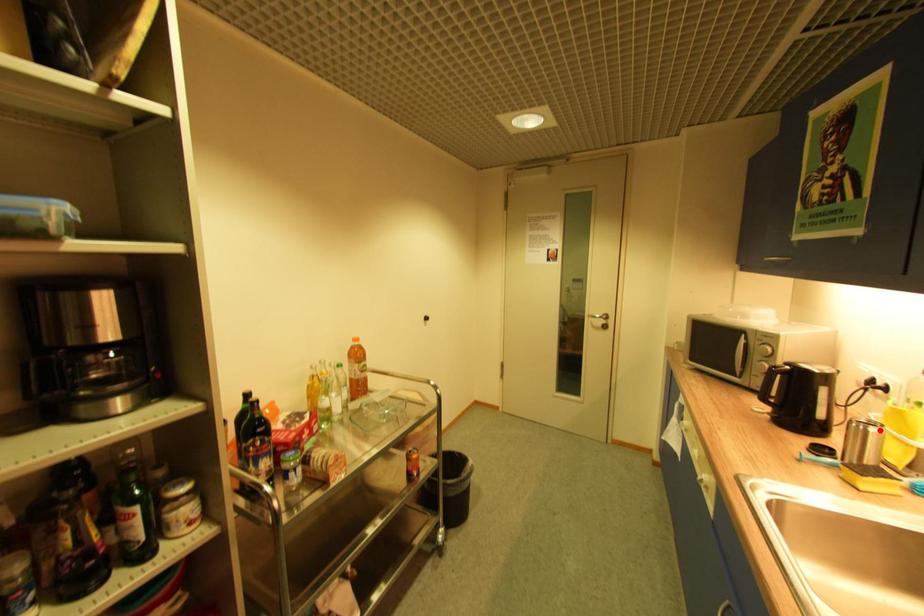
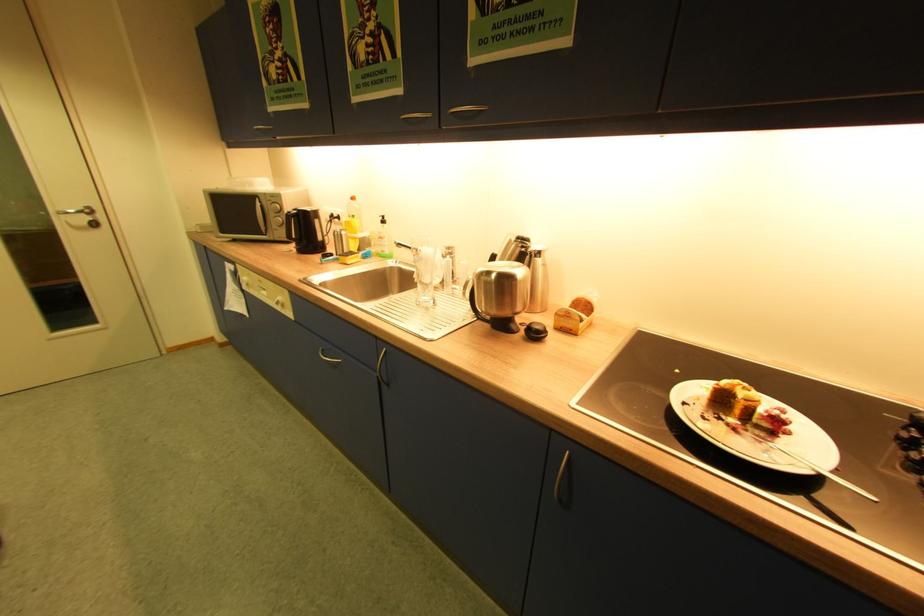
Find the pixel in the second image that matches the highlighted location in the first image.

(348, 233)